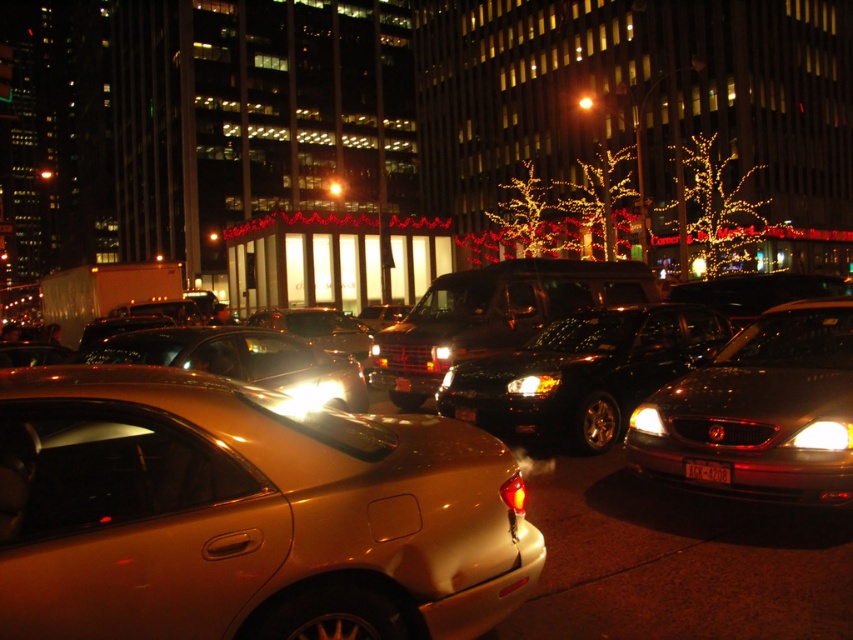
You are standing at the origin point in the city scene. You see a point at coordinate point (677, 305) and another at point (427, 292). Which point is closer to you?

Point (677, 305) is in front of point (427, 292), so it is closer to you.

You are a delivery person needing to load a package into the gold metallic car at center and the shiny metallic sedan at center. Which car should you approach first if you want to load the package closest to the street?

The shiny metallic sedan at center is on the left side of the gold metallic car at center. Since the gold metallic car at center is on the right side of the shiny metallic sedan at center, the shiny metallic sedan at center is closer to the street. Therefore, you should approach the shiny metallic sedan at center first to load the package closest to the street.